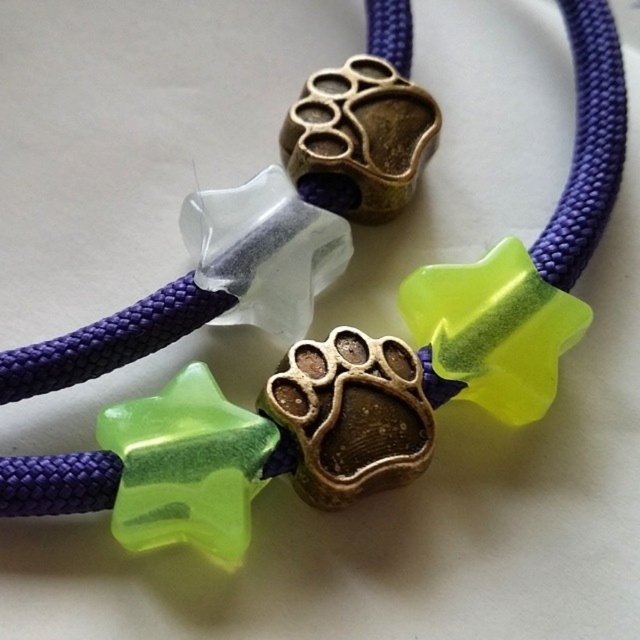
Question: Which object appears farthest from the camera in this image?

Choices:
 (A) bronze textured paw print at center
 (B) antique brass paw print at center

Answer: (B)

Question: Is bronze textured paw print at center to the right of antique brass paw print at center from the viewer's perspective?

Choices:
 (A) no
 (B) yes

Answer: (A)

Question: Which point is farther to the camera?

Choices:
 (A) (371, 436)
 (B) (406, 118)

Answer: (B)

Question: Is bronze textured paw print at center positioned before antique brass paw print at center?

Choices:
 (A) no
 (B) yes

Answer: (B)

Question: In this image, where is bronze textured paw print at center located relative to antique brass paw print at center?

Choices:
 (A) left
 (B) right

Answer: (A)